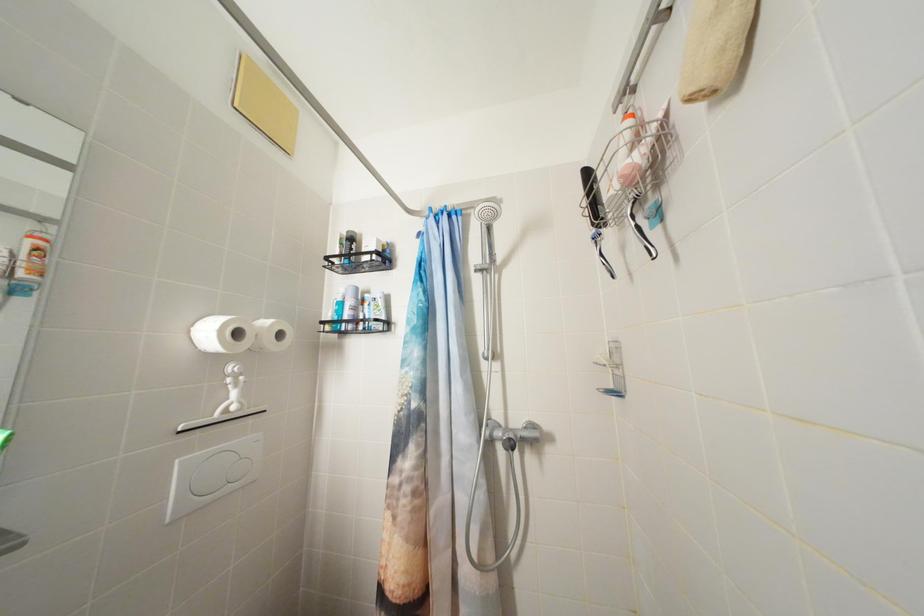
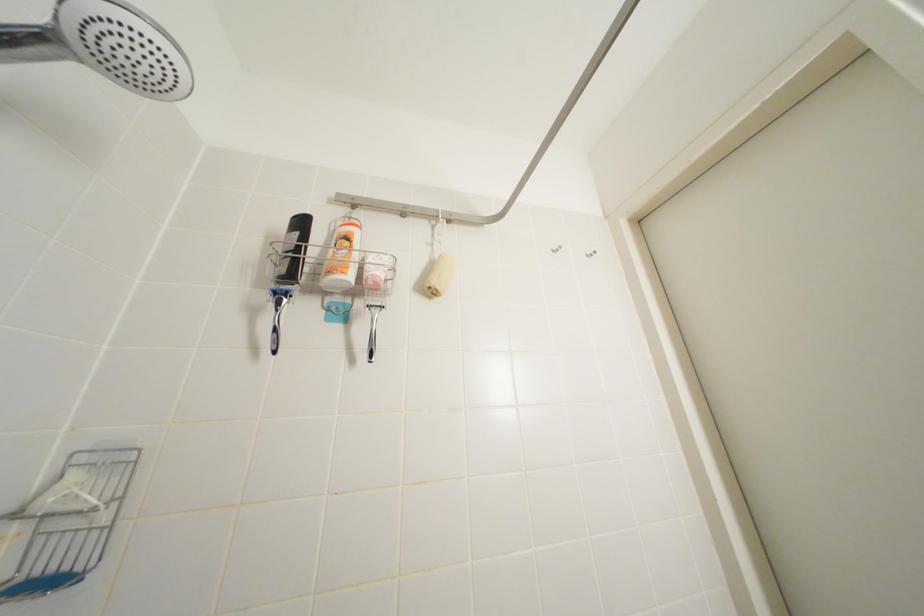
The first image is from the beginning of the video and the second image is from the end. How did the camera likely rotate when shooting the video?

The camera rotated toward right-up.